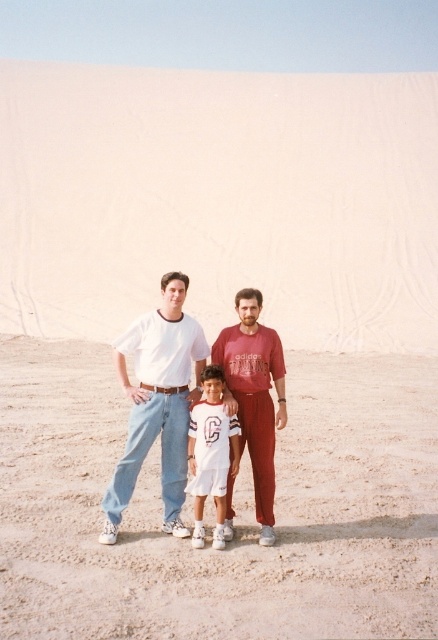
Can you confirm if white cotton t-shirt at center is positioned to the right of white cotton shirt at center?

No, white cotton t-shirt at center is not to the right of white cotton shirt at center.

Between white cotton t-shirt at center and white cotton shirt at center, which one is positioned higher?

Positioned higher is white cotton t-shirt at center.

Who is more forward, (166, 292) or (228, 460)?

Positioned in front is point (228, 460).

Where is `white cotton t-shirt at center`? The image size is (438, 640). white cotton t-shirt at center is located at coordinates (158, 403).

Does brown sandy dirt at center have a lesser width compared to white cotton t-shirt at center?

In fact, brown sandy dirt at center might be wider than white cotton t-shirt at center.

Which is behind, point (95, 468) or point (105, 536)?

The point (95, 468) is behind.

I want to click on brown sandy dirt at center, so click(x=235, y=508).

Can you confirm if brown sandy dirt at center is bigger than white cotton shirt at center?

Yes, brown sandy dirt at center is bigger than white cotton shirt at center.

Between point (402, 433) and point (226, 417), which one is positioned in front?

Point (226, 417) is in front.

Between point (303, 408) and point (222, 371), which one is positioned in front?

Point (222, 371) is in front.

You are a GUI agent. You are given a task and a screenshot of the screen. Output one action in this format:
    pyautogui.click(x=<x>, y=<y>)
    Task: Click on the brown sandy dirt at center
    
    Given the screenshot: What is the action you would take?
    pyautogui.click(x=235, y=508)